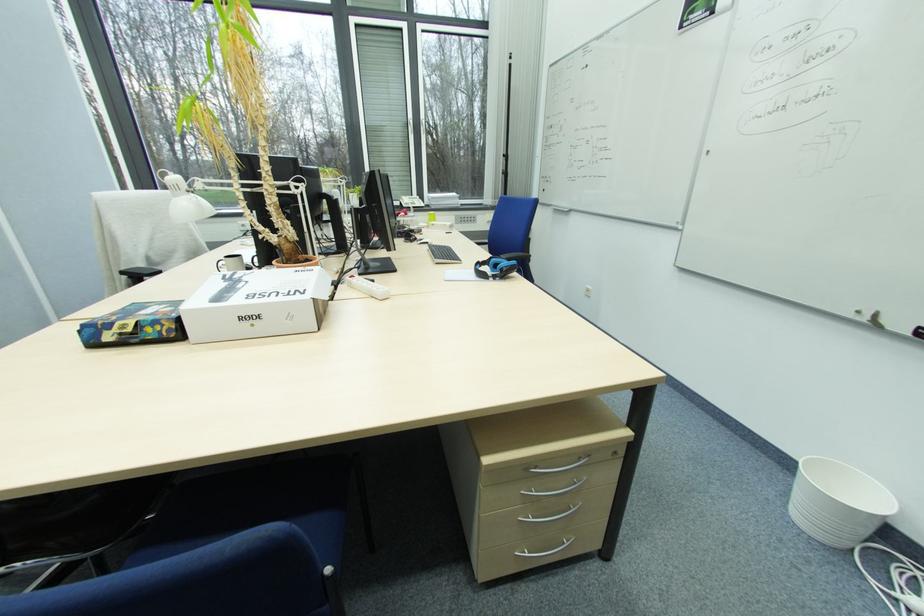
Where is `white mug handle`? This screenshot has height=616, width=924. white mug handle is located at coordinates (229, 262).